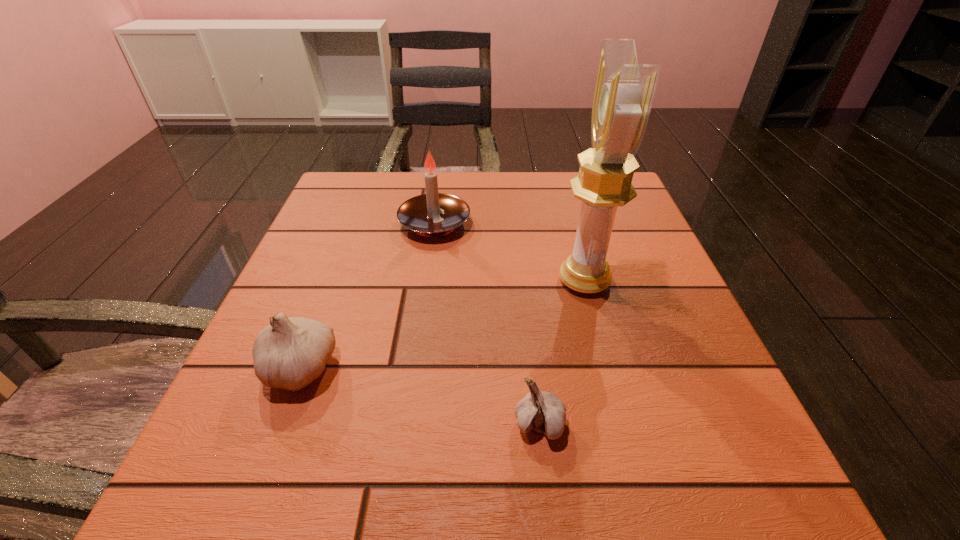
In order to click on the tallest object in this screenshot , I will do `click(624, 91)`.

This screenshot has height=540, width=960. Identify the location of the second farthest object. (624, 91).

Where is `the second object from left to right`? the second object from left to right is located at coordinates (421, 213).

Locate an element on the screen. This screenshot has width=960, height=540. the farthest object is located at coordinates (421, 213).

What are the coordinates of `the left garlic` in the screenshot? It's located at (290, 353).

The width and height of the screenshot is (960, 540). What are the coordinates of `the second nearest object` in the screenshot? It's located at (290, 353).

In order to click on the shorter garlic in this screenshot , I will do `click(544, 412)`.

Locate an element on the screen. This screenshot has height=540, width=960. the shortest object is located at coordinates (544, 412).

Locate an element on the screen. The width and height of the screenshot is (960, 540). free spot located 0.110m on the front-facing side of the rightmost object is located at coordinates (500, 281).

Identify the location of vacant position located on the front-facing side of the rightmost object. This screenshot has width=960, height=540. pos(442,281).